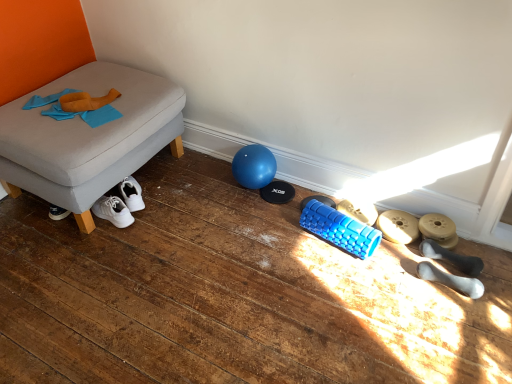
Image resolution: width=512 pixels, height=384 pixels. I want to click on free area in between gray fabric ottoman at left and blue rubber roller at lower center, the fifth footwear positioned from the front, so pyautogui.click(x=211, y=212).